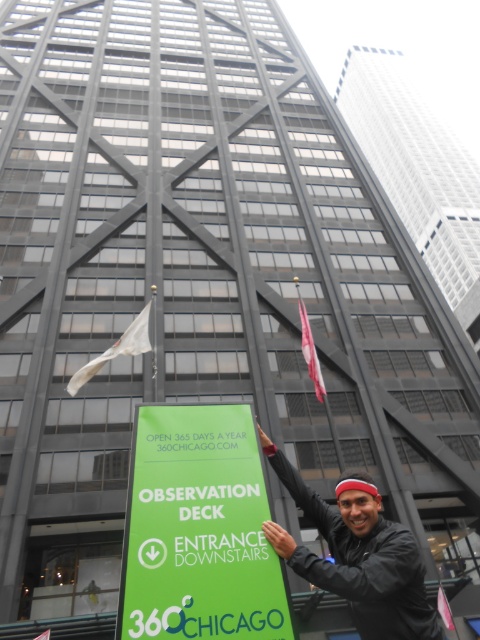
You are a tourist standing in front of the skyscraper and want to read the green matte sign at center. Can you see the red fabric flag at center behind the sign clearly?

The green matte sign at center is in front of the red fabric flag at center, so the flag may be partially or fully obscured depending on the sign size and distance.

What is the relationship between the width of the green matte sign at center and the white fabric flag at center in terms of size?

The green matte sign at center has a lesser width compared to the white fabric flag at center, so the white fabric flag at center is wider.